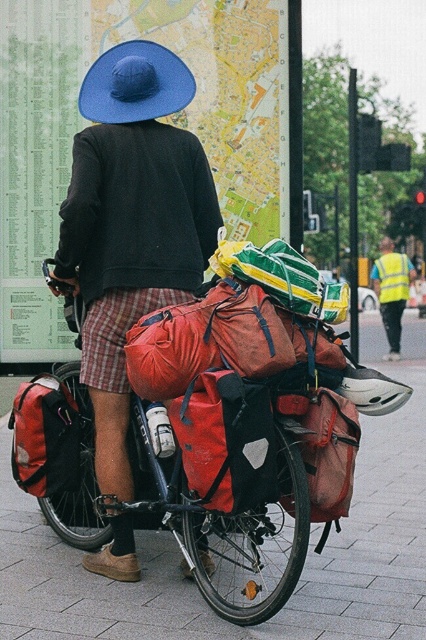
Is point (103, 374) closer to viewer compared to point (108, 90)?

Yes, it is.

Is matte black jacket at center positioned in front of blue fabric hat at upper center?

Yes, it is.

Measure the distance between point (196, 148) and camera.

The distance of point (196, 148) from camera is 4.88 meters.

The image size is (426, 640). I want to click on matte black jacket at center, so click(131, 225).

Does red fabric bag at center have a lesser width compared to matte red backpack at center?

No.

Does point (282, 436) lie behind point (310, 518)?

No, it is in front of (310, 518).

At what (x,y) coordinates should I click in order to perform the action: click on red fabric bag at center. Please return your answer as a coordinate pair (x, y). The width and height of the screenshot is (426, 640). Looking at the image, I should click on (224, 515).

Who is positioned more to the right, red fabric bag at center or matte red backpack at lower left?

red fabric bag at center is more to the right.

Does red fabric bag at center have a greater width compared to matte red backpack at lower left?

Correct, the width of red fabric bag at center exceeds that of matte red backpack at lower left.

The height and width of the screenshot is (640, 426). Find the location of `red fabric bag at center`. red fabric bag at center is located at coordinates (224, 515).

Find the location of `red fabric bag at center`. red fabric bag at center is located at coordinates (224, 515).